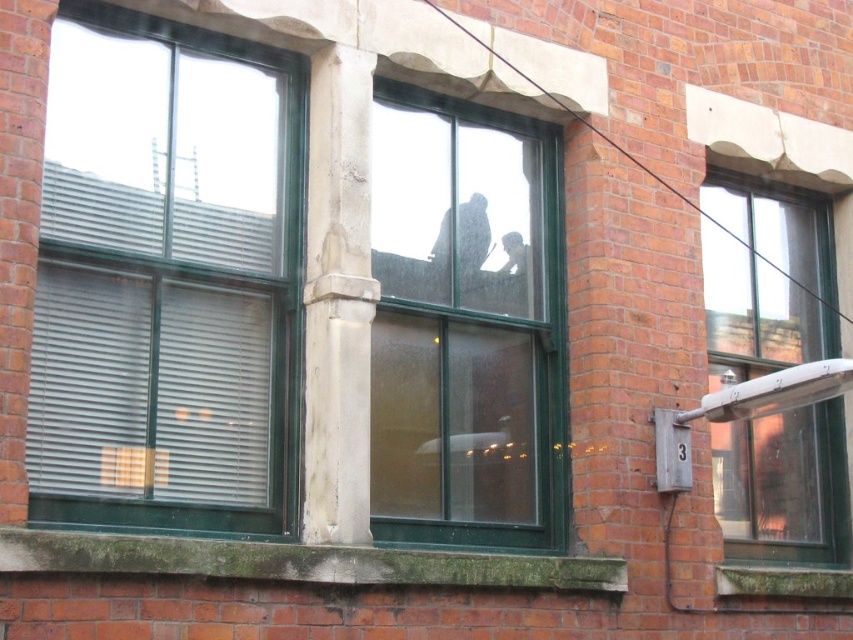
In the scene shown: Which of these two, green glass window at left or clear glass window at right, stands shorter?

Standing shorter between the two is green glass window at left.

Is point (236, 337) farther from camera compared to point (721, 188)?

No.

Find the location of a particular element. Image resolution: width=853 pixels, height=640 pixels. green glass window at left is located at coordinates (166, 278).

Image resolution: width=853 pixels, height=640 pixels. What do you see at coordinates (465, 324) in the screenshot?
I see `green glass window at center` at bounding box center [465, 324].

Between point (520, 468) and point (788, 362), which one is positioned in front?

Point (520, 468) is in front.

Locate an element on the screen. The width and height of the screenshot is (853, 640). green glass window at center is located at coordinates (465, 324).

Image resolution: width=853 pixels, height=640 pixels. I want to click on green glass window at center, so click(465, 324).

Describe the element at coordinates (166, 278) in the screenshot. I see `green glass window at left` at that location.

Can you confirm if green glass window at left is wider than green glass window at center?

Indeed, green glass window at left has a greater width compared to green glass window at center.

The height and width of the screenshot is (640, 853). Find the location of `green glass window at left`. green glass window at left is located at coordinates (166, 278).

Identify the location of green glass window at left. (166, 278).